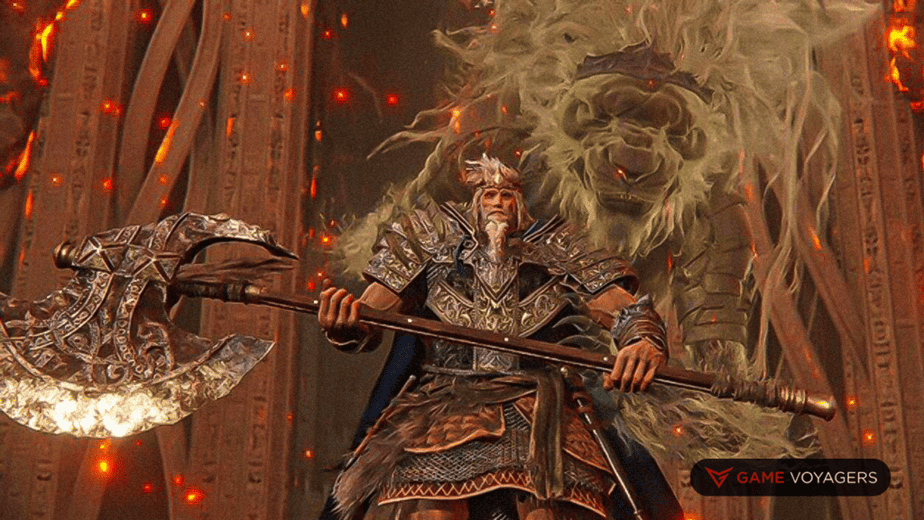
Where is `pillars`? This screenshot has height=520, width=924. pillars is located at coordinates (861, 172).